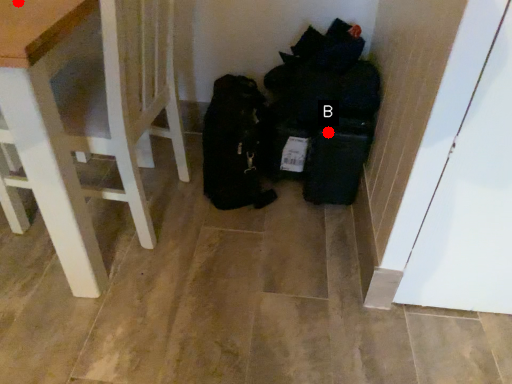
Question: Two points are circled on the image, labeled by A and B beside each circle. Which point appears closest to the camera in this image?

Choices:
 (A) A is closer
 (B) B is closer

Answer: (A)